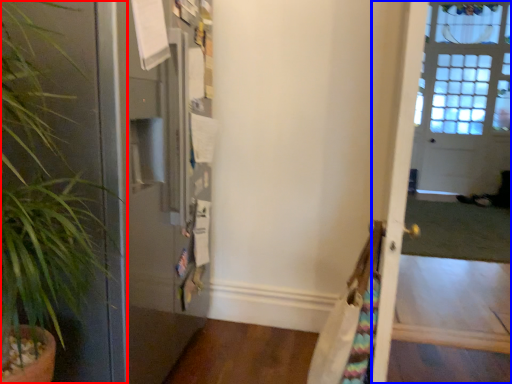
Question: Which object is further to the camera taking this photo, houseplant (highlighted by a red box) or screen door (highlighted by a blue box)?

Choices:
 (A) houseplant
 (B) screen door

Answer: (B)